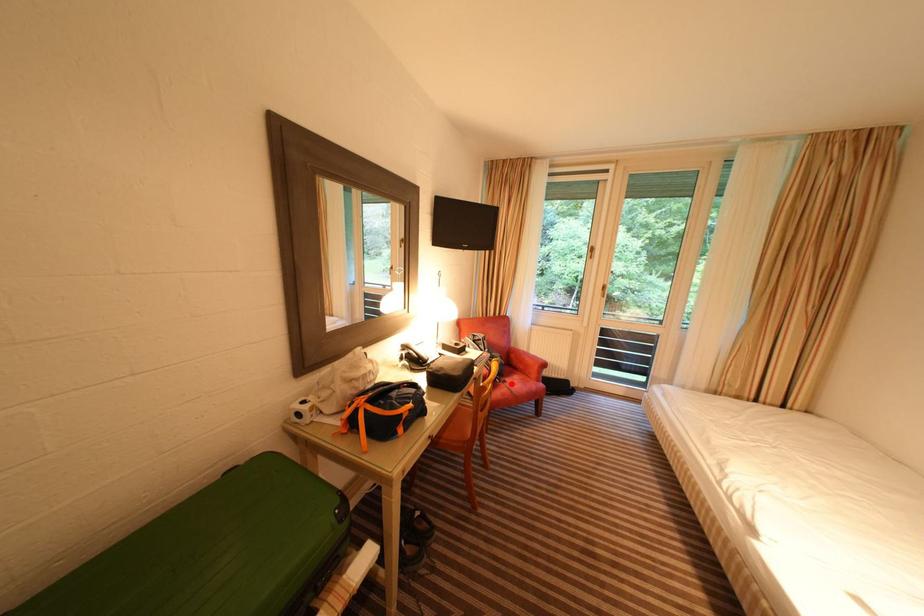
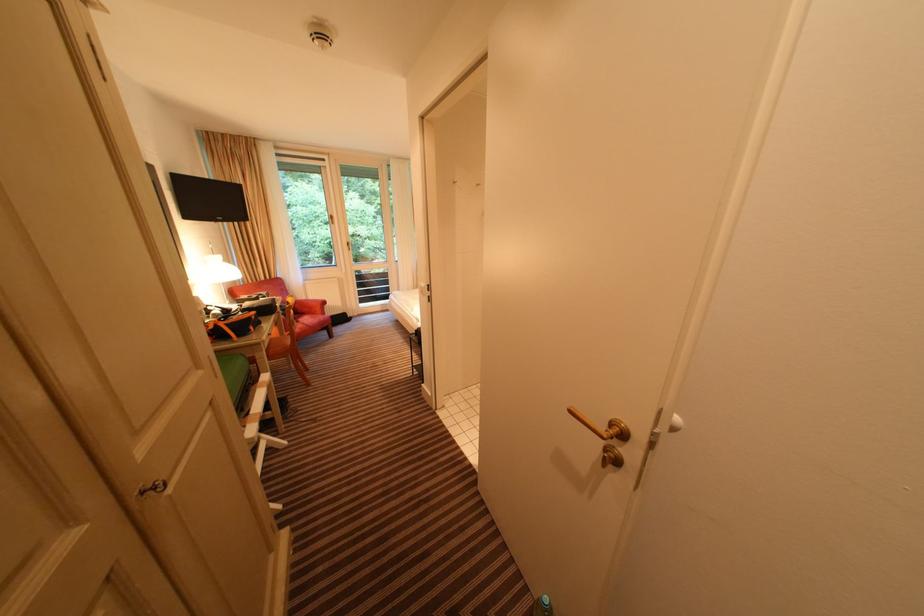
The point at the highlighted location is marked in the first image. Where is the corresponding point in the second image?

(305, 323)